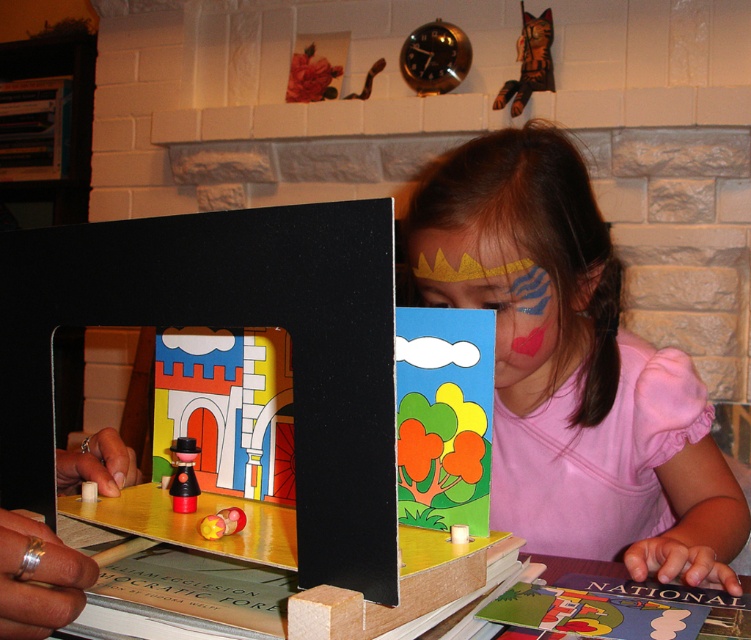
Question: Which is nearer to the pink fabric at center?

Choices:
 (A) wooden cat at upper center
 (B) smooth plastic toy at center
 (C) brushed metal toy at center

Answer: (C)

Question: Is pink fabric at center further to camera compared to matte pink face at center?

Choices:
 (A) no
 (B) yes

Answer: (A)

Question: Is pink fabric at center below brushed metal toy at center?

Choices:
 (A) yes
 (B) no

Answer: (B)

Question: Among these points, which one is farthest from the camera?

Choices:
 (A) (523, 376)
 (B) (178, 481)
 (C) (231, 522)

Answer: (A)

Question: Among these points, which one is farthest from the camera?

Choices:
 (A) (517, 81)
 (B) (243, 518)

Answer: (A)

Question: In this image, where is matte pink face at center located relative to wooden cat at upper center?

Choices:
 (A) left
 (B) right

Answer: (A)